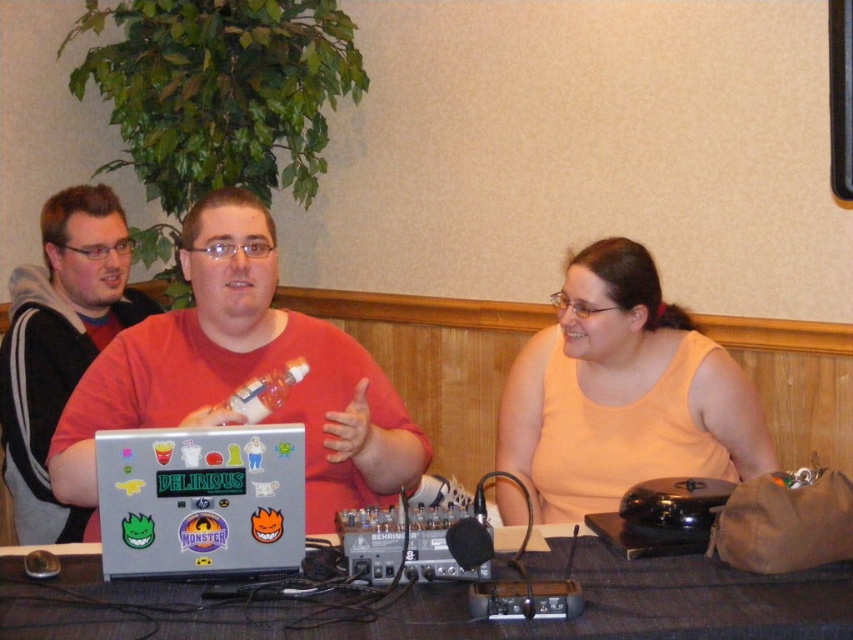
Who is shorter, light orange tank top at center or gray fabric table at center?

With less height is gray fabric table at center.

Which is behind, point (614, 461) or point (706, 634)?

Positioned behind is point (614, 461).

Is point (665, 438) in front of point (270, 627)?

No.

At what (x,y) coordinates should I click in order to perform the action: click on light orange tank top at center. Please return your answer as a coordinate pair (x, y). The width and height of the screenshot is (853, 640). Looking at the image, I should click on (622, 392).

Between shiny metallic laptop at center and gray fabric table at center, which one has less height?

gray fabric table at center

Who is lower down, shiny metallic laptop at center or gray fabric table at center?

gray fabric table at center is lower down.

Who is more distant from viewer, (202, 218) or (177, 589)?

Point (202, 218)

This screenshot has width=853, height=640. Find the location of `shiny metallic laptop at center`. shiny metallic laptop at center is located at coordinates (242, 372).

Who is positioned more to the left, shiny metallic laptop at center or sticker-covered silver laptop at center?

Positioned to the left is shiny metallic laptop at center.

Who is higher up, shiny metallic laptop at center or sticker-covered silver laptop at center?

shiny metallic laptop at center is higher up.

You are a GUI agent. You are given a task and a screenshot of the screen. Output one action in this format:
    pyautogui.click(x=<x>, y=<y>)
    Task: Click on the shiny metallic laptop at center
    The image size is (853, 640).
    Given the screenshot: What is the action you would take?
    pyautogui.click(x=242, y=372)

This screenshot has height=640, width=853. In order to click on shiny metallic laptop at center in this screenshot , I will do `click(242, 372)`.